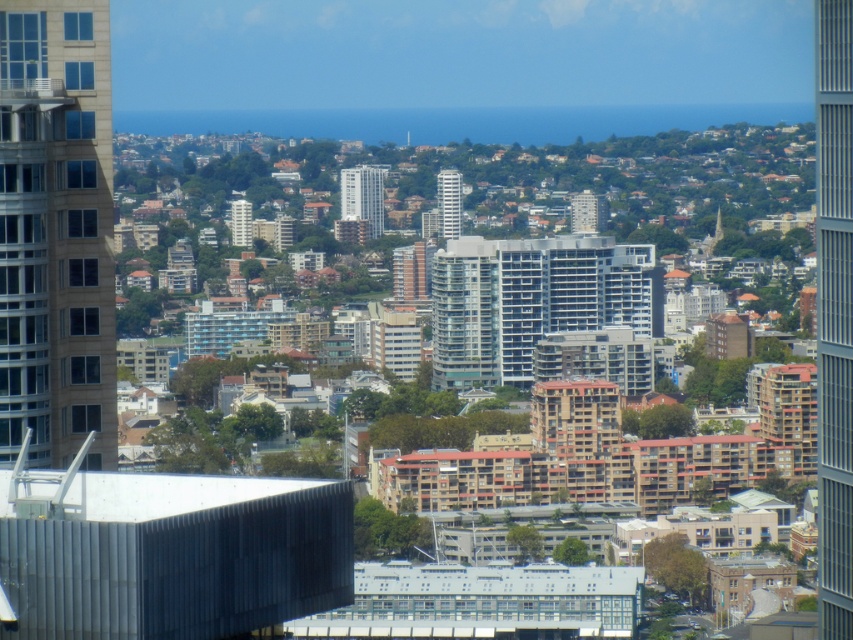
Is white glossy building at center thinner than white glass tower at center?

No, white glossy building at center is not thinner than white glass tower at center.

In the scene shown: Who is higher up, white glossy building at center or white glass tower at center?

white glossy building at center

Who is more distant from viewer, (363,204) or (444,192)?

Positioned behind is point (444,192).

The image size is (853, 640). I want to click on white glossy building at center, so click(x=363, y=195).

Measure the distance between beige glass building at left and matte gray building at center.

The distance of beige glass building at left from matte gray building at center is 116.88 meters.

Can you confirm if beige glass building at left is positioned to the right of matte gray building at center?

In fact, beige glass building at left is to the left of matte gray building at center.

Identify the location of beige glass building at left. (55, 232).

Locate an element on the screen. beige glass building at left is located at coordinates tap(55, 232).

Does glassy steel skyscraper at right come in front of white glossy building at center?

No, glassy steel skyscraper at right is behind white glossy building at center.

Does glassy steel skyscraper at right come behind white glossy building at center?

Yes, it is.

The width and height of the screenshot is (853, 640). What are the coordinates of `glassy steel skyscraper at right` in the screenshot? It's located at (834, 312).